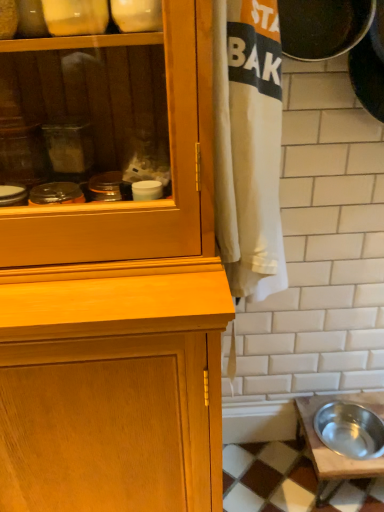
Where is `silver metallic bowl at lower right`? silver metallic bowl at lower right is located at coordinates (329, 449).

What do you see at coordinates (329, 449) in the screenshot?
I see `silver metallic bowl at lower right` at bounding box center [329, 449].

This screenshot has height=512, width=384. I want to click on silver metallic bowl at lower right, so click(329, 449).